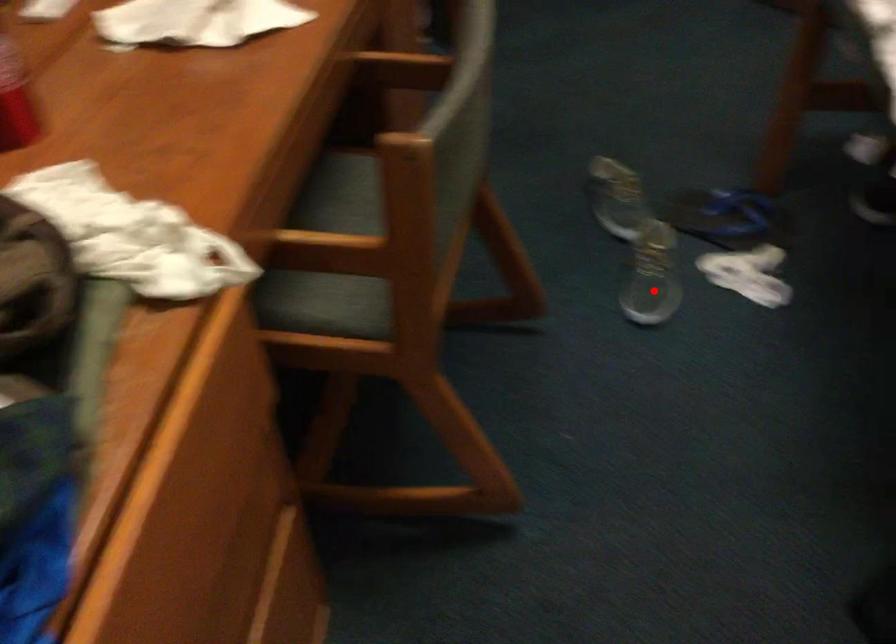
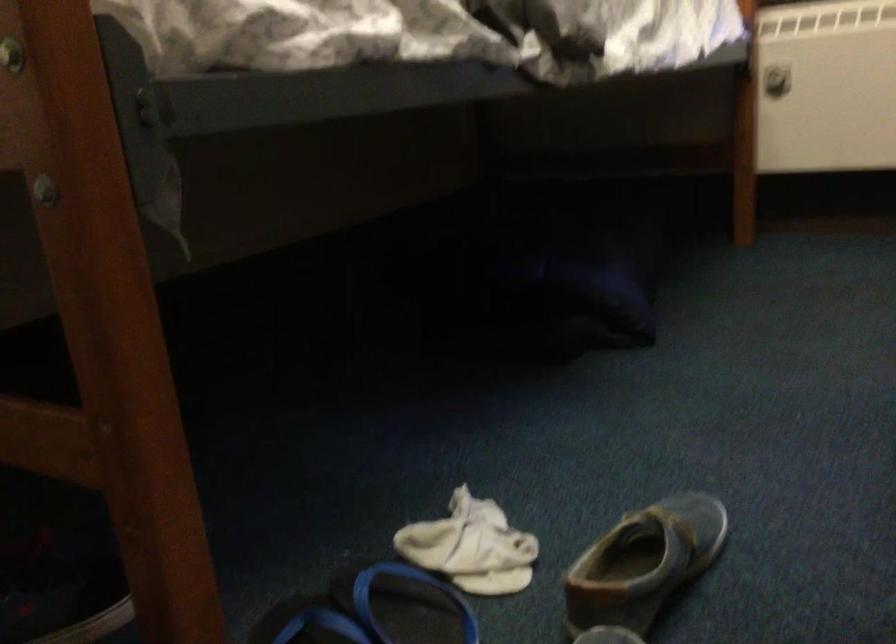
Where in the second image is the point corresponding to the highlighted location from the first image?

(643, 563)